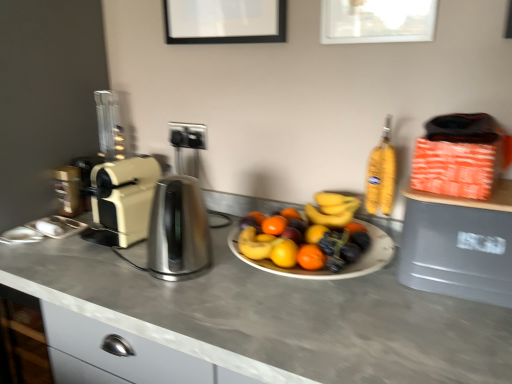
Locate an element on the screen. vacant location below satin silver kettle at center (from a real-world perspective) is located at coordinates (166, 277).